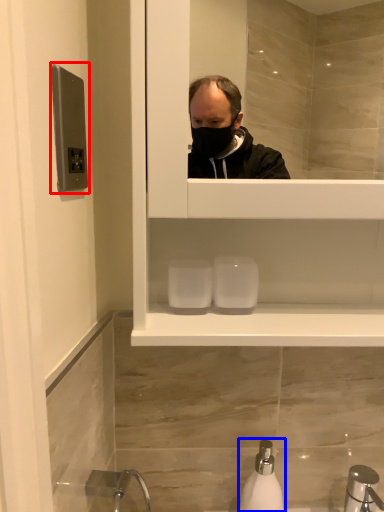
Question: Which of the following is the closest to the observer, door handle (highlighted by a red box) or soap dispenser (highlighted by a blue box)?

Choices:
 (A) door handle
 (B) soap dispenser

Answer: (A)